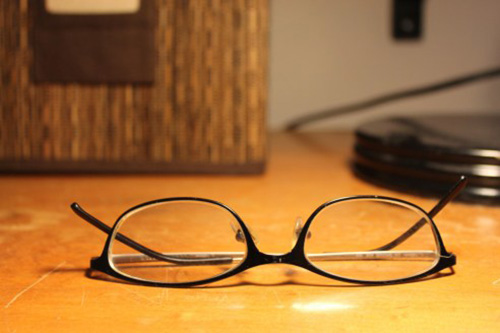
At what (x,y) coordinates should I click in order to perform the action: click on black wire. Please return your answer as a coordinate pair (x, y). The height and width of the screenshot is (333, 500). Looking at the image, I should click on (390, 96).